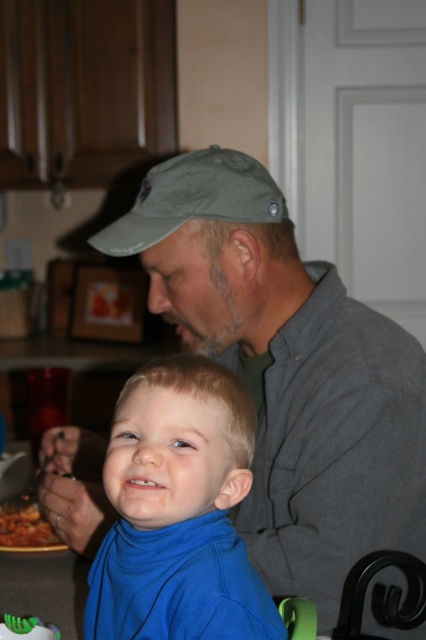
Is olive green fabric baseball cap at upper center above tomato sauce at lower left?

Yes.

Can you confirm if olive green fabric baseball cap at upper center is bigger than tomato sauce at lower left?

Correct, olive green fabric baseball cap at upper center is larger in size than tomato sauce at lower left.

Identify the location of olive green fabric baseball cap at upper center. (193, 198).

At what (x,y) coordinates should I click in order to perform the action: click on olive green fabric baseball cap at upper center. Please return your answer as a coordinate pair (x, y). The image size is (426, 640). Looking at the image, I should click on (193, 198).

Is point (294, 564) positioned behind point (180, 154)?

That is False.

Is gray cotton shirt at upper right above olive green fabric baseball cap at upper center?

No.

This screenshot has height=640, width=426. What are the coordinates of `gray cotton shirt at upper right` in the screenshot? It's located at (287, 371).

Who is positioned more to the right, blue turtleneck shirt at center or tomato sauce at lower left?

From the viewer's perspective, blue turtleneck shirt at center appears more on the right side.

Is point (229, 616) farther from viewer compared to point (14, 506)?

No, it is in front of (14, 506).

Where is `blue turtleneck shirt at center`? blue turtleneck shirt at center is located at coordinates (178, 512).